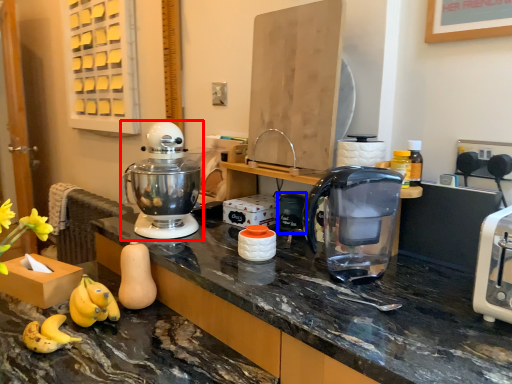
Question: Which object appears farthest to the camera in this image, mixer (highlighted by a red box) or appliance (highlighted by a blue box)?

Choices:
 (A) mixer
 (B) appliance

Answer: (B)